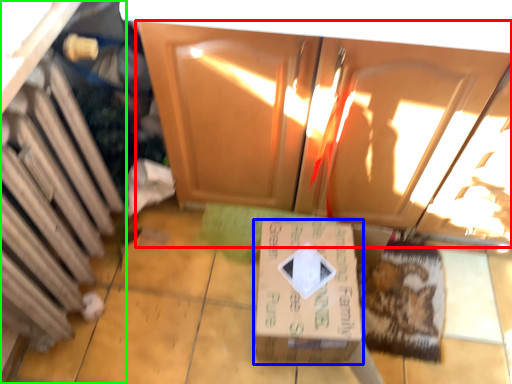
Question: Which object is positioned closest to cabinetry (highlighted by a red box)? Select from box (highlighted by a blue box) and cabinetry (highlighted by a green box).

Choices:
 (A) box
 (B) cabinetry

Answer: (A)